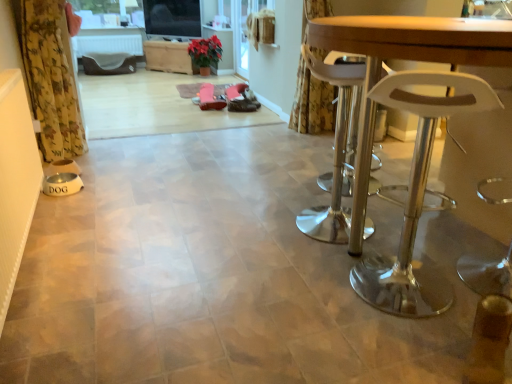
Where is `vacant area that is in front of clear plastic stool at right`? vacant area that is in front of clear plastic stool at right is located at coordinates (398, 343).